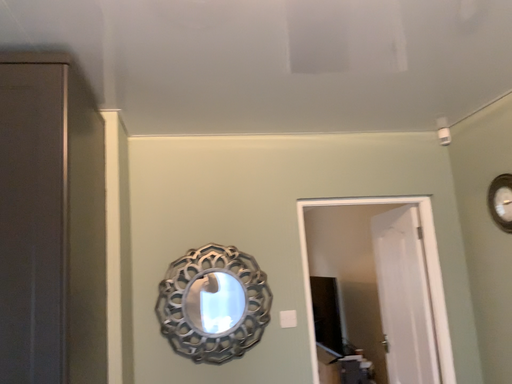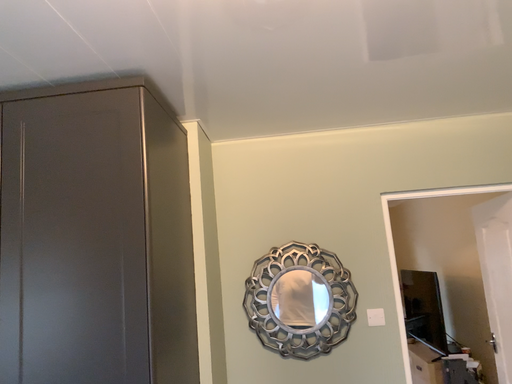
Question: Which way did the camera rotate in the video?

Choices:
 (A) rotated left
 (B) rotated right

Answer: (A)